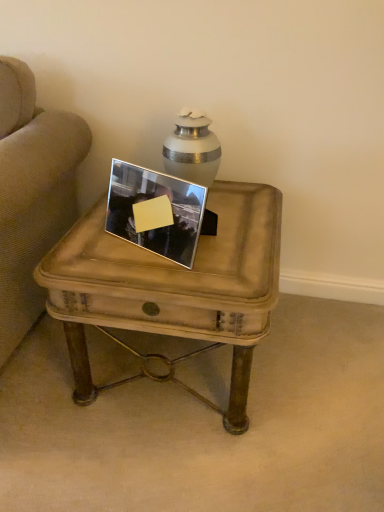
At what (x,y) coordinates should I click in order to perform the action: click on free space to the left of silver metallic picture frame at center. Please return your answer as a coordinate pair (x, y). The height and width of the screenshot is (512, 384). Looking at the image, I should click on (87, 246).